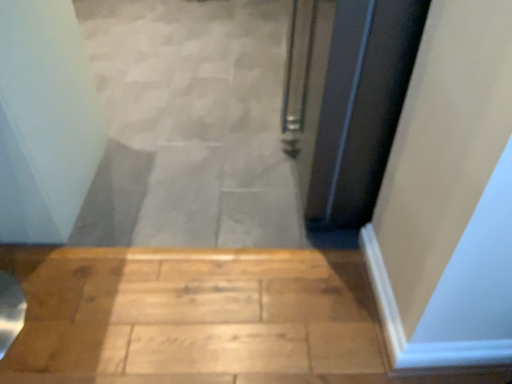
The width and height of the screenshot is (512, 384). In order to click on smooth concrete stairs at center in this screenshot , I will do `click(190, 125)`.

The height and width of the screenshot is (384, 512). What do you see at coordinates (190, 125) in the screenshot?
I see `smooth concrete stairs at center` at bounding box center [190, 125].

Describe the element at coordinates (347, 99) in the screenshot. I see `black glossy door at upper right` at that location.

What are the coordinates of `black glossy door at upper right` in the screenshot? It's located at (347, 99).

I want to click on smooth concrete stairs at center, so click(190, 125).

Based on their positions, is black glossy door at upper right located to the left or right of smooth concrete stairs at center?

From the image, it's evident that black glossy door at upper right is to the right of smooth concrete stairs at center.

Relative to smooth concrete stairs at center, is black glossy door at upper right in front or behind?

Result: In the image, black glossy door at upper right appears in front of smooth concrete stairs at center.

Is point (388, 125) positioned behind point (97, 178)?

No, (388, 125) is in front of (97, 178).

From the image's perspective, is black glossy door at upper right located above smooth concrete stairs at center?

Incorrect, from the image's perspective, black glossy door at upper right is lower than smooth concrete stairs at center.

From a real-world perspective, is black glossy door at upper right physically below smooth concrete stairs at center?

No, from a real-world perspective, black glossy door at upper right is not below smooth concrete stairs at center.

From the picture: Considering the sizes of objects black glossy door at upper right and smooth concrete stairs at center in the image provided, who is wider, black glossy door at upper right or smooth concrete stairs at center?

Wider between the two is smooth concrete stairs at center.

Is black glossy door at upper right shorter than smooth concrete stairs at center?

No, black glossy door at upper right is not shorter than smooth concrete stairs at center.

Who is smaller, black glossy door at upper right or smooth concrete stairs at center?

smooth concrete stairs at center.

Can we say black glossy door at upper right lies outside smooth concrete stairs at center?

Absolutely, black glossy door at upper right is external to smooth concrete stairs at center.

Is black glossy door at upper right not close to smooth concrete stairs at center?

No, black glossy door at upper right is not far from smooth concrete stairs at center.

Is black glossy door at upper right aimed at smooth concrete stairs at center?

No, black glossy door at upper right does not turn towards smooth concrete stairs at center.

Can you tell me how much black glossy door at upper right and smooth concrete stairs at center differ in facing direction?

They differ by 87.8 degrees in their facing directions.

Locate an element on the screen. stairwell that appears behind the black glossy door at upper right is located at coordinates (190, 125).

From the picture: Considering the relative positions of smooth concrete stairs at center and black glossy door at upper right in the image provided, is smooth concrete stairs at center to the left of black glossy door at upper right from the viewer's perspective?

Indeed, smooth concrete stairs at center is positioned on the left side of black glossy door at upper right.

Is the depth of smooth concrete stairs at center greater than that of black glossy door at upper right?

Yes, it is.

Is point (179, 239) farther from viewer compared to point (364, 25)?

Yes, it is.

From the image's perspective, is smooth concrete stairs at center above or below black glossy door at upper right?

Based on their image positions, smooth concrete stairs at center is located above black glossy door at upper right.

From a real-world perspective, is smooth concrete stairs at center positioned above or below black glossy door at upper right?

In terms of real-world spatial position, smooth concrete stairs at center is below black glossy door at upper right.

Between smooth concrete stairs at center and black glossy door at upper right, which one has larger width?

Wider between the two is smooth concrete stairs at center.

Considering the sizes of objects smooth concrete stairs at center and black glossy door at upper right in the image provided, who is shorter, smooth concrete stairs at center or black glossy door at upper right?

smooth concrete stairs at center.

Looking at the image, does smooth concrete stairs at center seem bigger or smaller compared to black glossy door at upper right?

Considering their sizes, smooth concrete stairs at center takes up less space than black glossy door at upper right.

Is black glossy door at upper right located within smooth concrete stairs at center?

No, smooth concrete stairs at center does not contain black glossy door at upper right.

Can you see smooth concrete stairs at center touching black glossy door at upper right?

No, smooth concrete stairs at center is not making contact with black glossy door at upper right.

Is smooth concrete stairs at center looking in the opposite direction of black glossy door at upper right?

No, smooth concrete stairs at center is not facing away from black glossy door at upper right.

How many degrees apart are the facing directions of smooth concrete stairs at center and black glossy door at upper right?

The angular difference between smooth concrete stairs at center and black glossy door at upper right is 87.8 degrees.

In the image, there is a smooth concrete stairs at center. At what (x,y) coordinates should I click in order to perform the action: click on door below it (from the image's perspective). Please return your answer as a coordinate pair (x, y). The image size is (512, 384). Looking at the image, I should click on (347, 99).

Locate an element on the screen. The height and width of the screenshot is (384, 512). stairwell below the black glossy door at upper right (from a real-world perspective) is located at coordinates (190, 125).

At what (x,y) coordinates should I click in order to perform the action: click on stairwell located above the black glossy door at upper right (from the image's perspective). Please return your answer as a coordinate pair (x, y). The height and width of the screenshot is (384, 512). Looking at the image, I should click on coord(190,125).